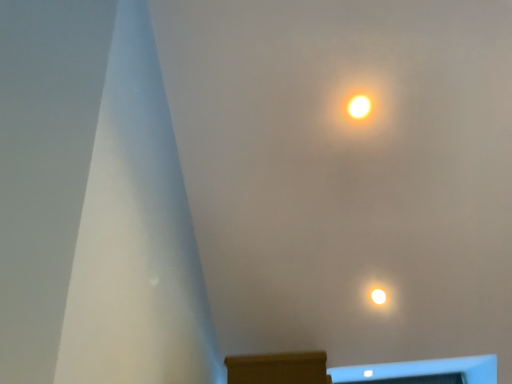
Question: In terms of size, does bright yellow bulb at upper center appear bigger or smaller than brown wood mantle at lower center?

Choices:
 (A) small
 (B) big

Answer: (A)

Question: From the image's perspective, is bright yellow bulb at upper center above or below brown wood mantle at lower center?

Choices:
 (A) below
 (B) above

Answer: (B)

Question: From their relative heights in the image, would you say bright yellow bulb at upper center is taller or shorter than brown wood mantle at lower center?

Choices:
 (A) tall
 (B) short

Answer: (A)

Question: From the image's perspective, is brown wood mantle at lower center located above or below bright yellow bulb at upper center?

Choices:
 (A) below
 (B) above

Answer: (A)

Question: Relative to bright yellow bulb at upper center, is brown wood mantle at lower center in front or behind?

Choices:
 (A) front
 (B) behind

Answer: (A)

Question: Is point (318, 372) closer or farther from the camera than point (358, 107)?

Choices:
 (A) closer
 (B) farther

Answer: (A)

Question: Considering the positions of brown wood mantle at lower center and bright yellow bulb at upper center in the image, is brown wood mantle at lower center taller or shorter than bright yellow bulb at upper center?

Choices:
 (A) tall
 (B) short

Answer: (B)